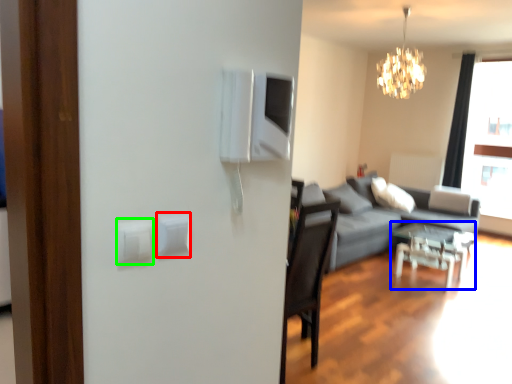
Question: Based on their relative distances, which object is farther from light switch (highlighted by a red box)? Choose from table (highlighted by a blue box) and light switch (highlighted by a green box).

Choices:
 (A) table
 (B) light switch

Answer: (A)